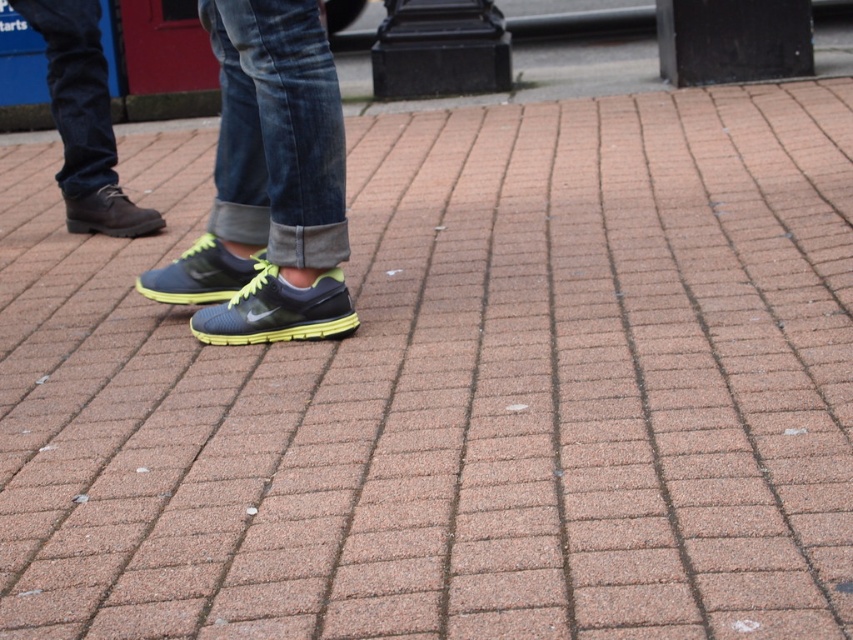
Question: Which of the following is the farthest from the observer?

Choices:
 (A) matte black sneakers at center
 (B) matte brown boot at left
 (C) matte blue running shoe at center
 (D) matte leather shoe at left

Answer: (B)

Question: Estimate the real-world distances between objects in this image. Which object is farther from the matte black shoe at center?

Choices:
 (A) matte blue running shoe at center
 (B) matte brown boot at left
 (C) matte black sneakers at center

Answer: (B)

Question: Can you confirm if matte black sneakers at center is thinner than matte blue running shoe at center?

Choices:
 (A) yes
 (B) no

Answer: (B)

Question: Which of these objects is positioned farthest from the matte blue running shoe at center?

Choices:
 (A) matte black sneakers at center
 (B) matte black shoe at center
 (C) matte brown boot at left

Answer: (C)

Question: Can you confirm if matte leather shoe at left is positioned above matte brown boot at left?

Choices:
 (A) no
 (B) yes

Answer: (B)

Question: Can you confirm if matte black shoe at center is positioned to the right of matte brown boot at left?

Choices:
 (A) no
 (B) yes

Answer: (B)